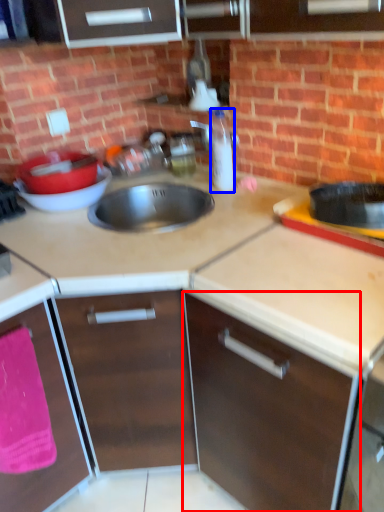
Question: Which point is further to the camera, cabinetry (highlighted by a red box) or bottle (highlighted by a blue box)?

Choices:
 (A) cabinetry
 (B) bottle

Answer: (B)